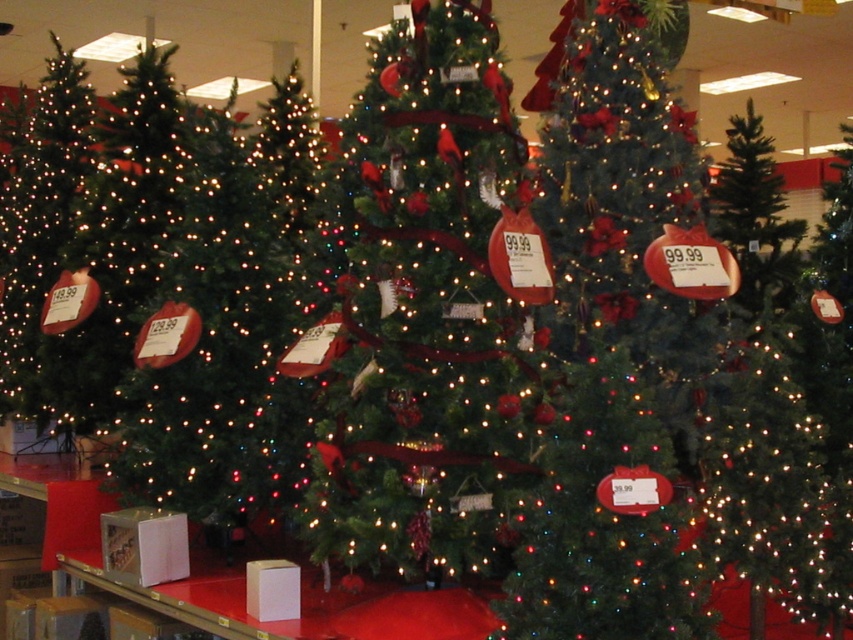
You are standing in the middle of the store and want to find the shiny green christmas tree at center. According to the coordinates provided, where should you look relative to your current position?

The shiny green christmas tree at center is located at point 0.539 on the x axis and 0.721 on the y axis, so you should look to the right and slightly forward from your current position in the store.

You are a customer in a store looking to buy a Christmas tree. You see the green matte christmas tree at center and the shiny green christmas tree at left. Which one is smaller in size?

The green matte christmas tree at center is smaller compared to the shiny green christmas tree at left, so the green matte christmas tree at center is the smaller one.